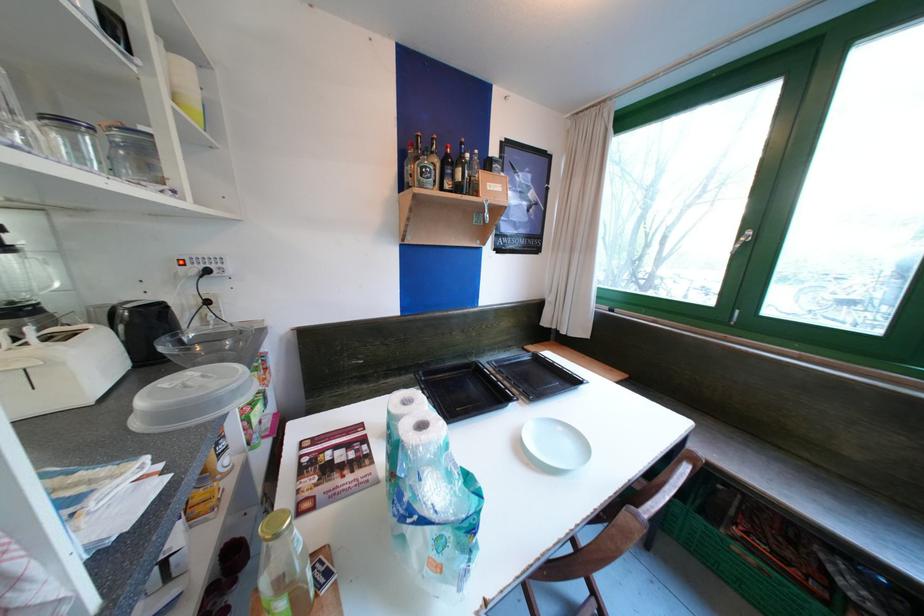
Locate an element on the screen. Image resolution: width=924 pixels, height=616 pixels. red power switch is located at coordinates (180, 262).